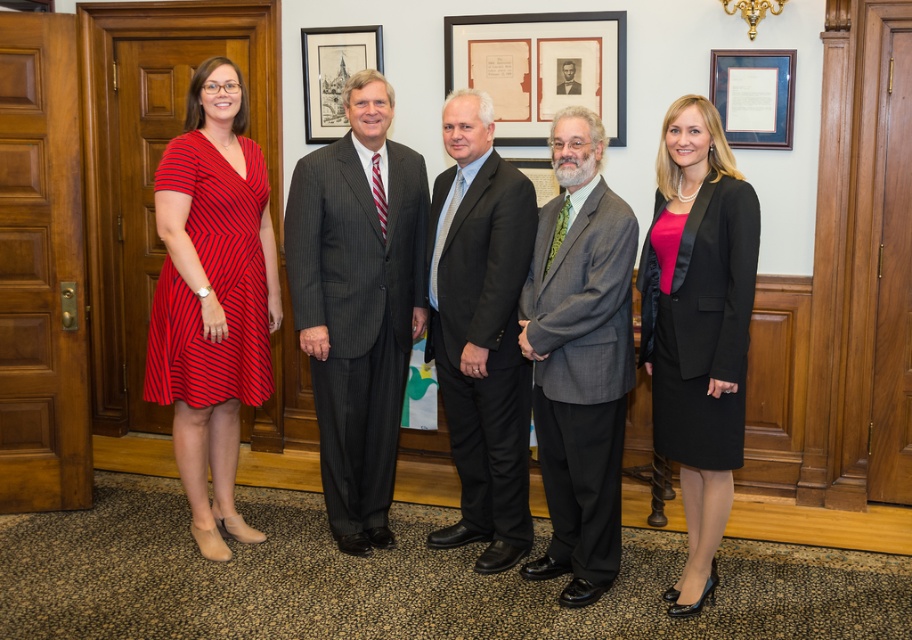
Question: Which point is farther to the camera?

Choices:
 (A) matte wooden picture frame at upper center
 (B) black satin blazer at right
 (C) dark gray suit at center

Answer: (A)

Question: Based on their relative distances, which object is farther from the dark gray suit at center?

Choices:
 (A) matte blue picture frame at upper right
 (B) black formal suit at center

Answer: (A)

Question: Is dark gray pinstripe suit at center below matte wooden picture frame at upper center?

Choices:
 (A) no
 (B) yes

Answer: (B)

Question: Which object is closer to the camera taking this photo?

Choices:
 (A) matte blue picture frame at upper right
 (B) gray wool suit at center

Answer: (B)

Question: Does matte wooden picture frame at upper center have a lesser width compared to matte blue picture frame at upper right?

Choices:
 (A) no
 (B) yes

Answer: (A)

Question: Does matte blue picture frame at upper right have a smaller size compared to black formal suit at center?

Choices:
 (A) yes
 (B) no

Answer: (B)